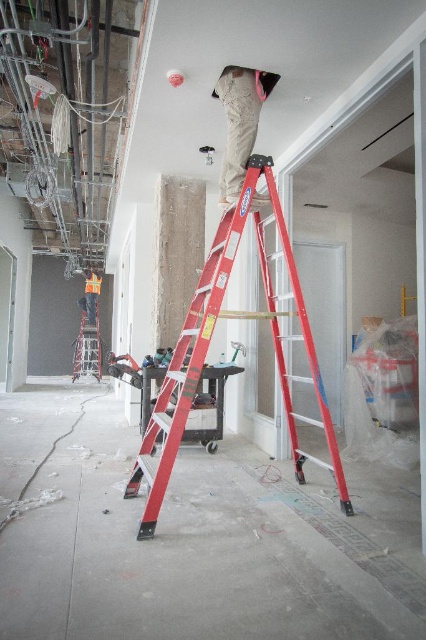
Which is more to the left, metallic silver ladder at center or reflective orange vest at center?

From the viewer's perspective, reflective orange vest at center appears more on the left side.

Between metallic silver ladder at center and reflective orange vest at center, which one appears on the right side from the viewer's perspective?

metallic silver ladder at center is more to the right.

The width and height of the screenshot is (426, 640). Describe the element at coordinates (88, 340) in the screenshot. I see `metallic silver ladder at center` at that location.

This screenshot has width=426, height=640. I want to click on metallic silver ladder at center, so click(x=88, y=340).

Can you confirm if khaki cotton pants at center is positioned above reflective orange vest at center?

Yes, khaki cotton pants at center is above reflective orange vest at center.

Between point (221, 186) and point (89, 314), which one is positioned behind?

The point (89, 314) is more distant.

Where is `khaki cotton pants at center`? khaki cotton pants at center is located at coordinates (239, 122).

Consider the image. Is red metallic ladder at center positioned at the back of metallic silver ladder at center?

No, red metallic ladder at center is in front of metallic silver ladder at center.

Who is positioned more to the left, red metallic ladder at center or metallic silver ladder at center?

metallic silver ladder at center

Identify the location of red metallic ladder at center. Image resolution: width=426 pixels, height=640 pixels. (209, 344).

What are the coordinates of `red metallic ladder at center` in the screenshot? It's located at (209, 344).